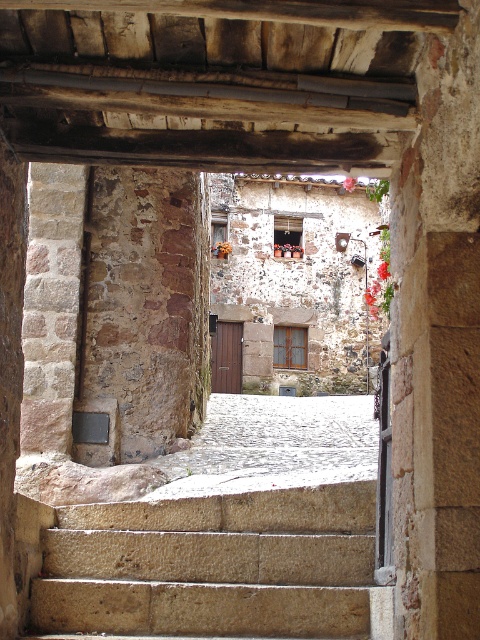
Looking at this image, you are a painter standing at the entrance of the archway. You want to paint the natural stone stairs at center and the rustic stone pillar at left. Which object should you place higher on your canvas to accurately represent their real positions?

The rustic stone pillar at left should be placed higher on the canvas because it has a greater height than the natural stone stairs at center.